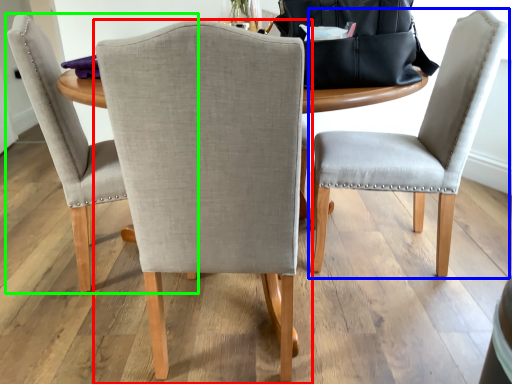
Question: Considering the real-world distances, which object is closest to chair (highlighted by a red box)? chair (highlighted by a blue box) or chair (highlighted by a green box).

Choices:
 (A) chair
 (B) chair

Answer: (B)